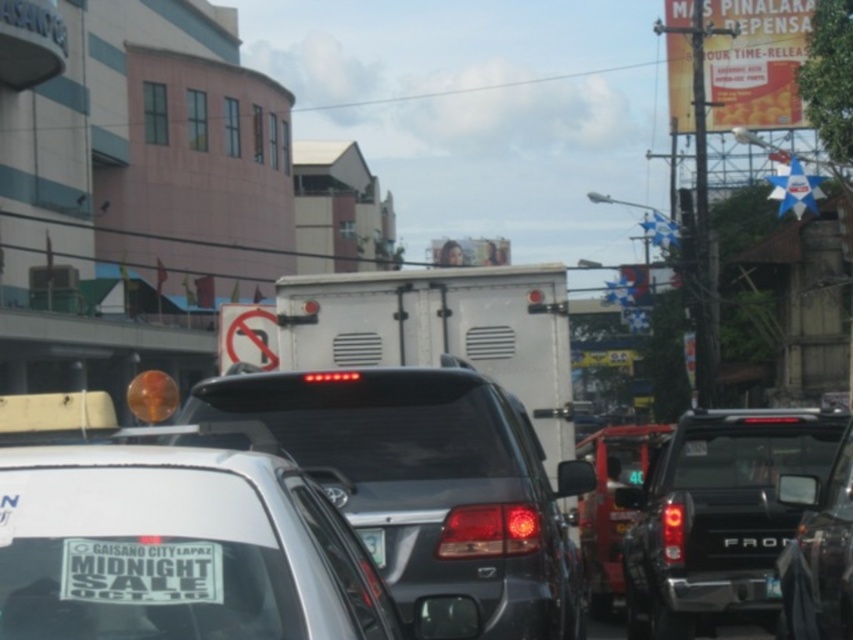
You are standing on the sidewalk and looking at the scene. Which of the two points, point (154, 508) or point (608, 428), is closer to you?

Point (154, 508) is closer to the viewer than point (608, 428).

You are standing at the origin point of the image coordinate system. Which of the two points, point (432, 396) or point (618, 570), is closer to you?

Point (432, 396) is in front of point (618, 570), so it is closer to you.